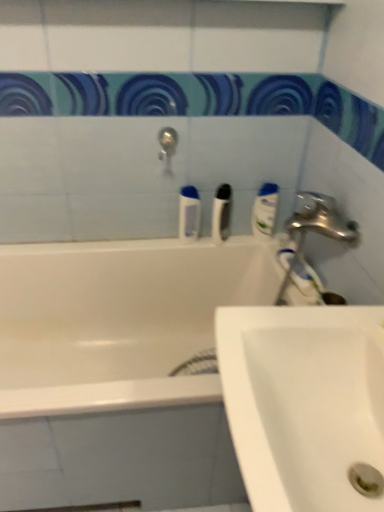
Find the location of `vacant area that lies to the right of white plastic toothbrush at center`. vacant area that lies to the right of white plastic toothbrush at center is located at coordinates (259, 244).